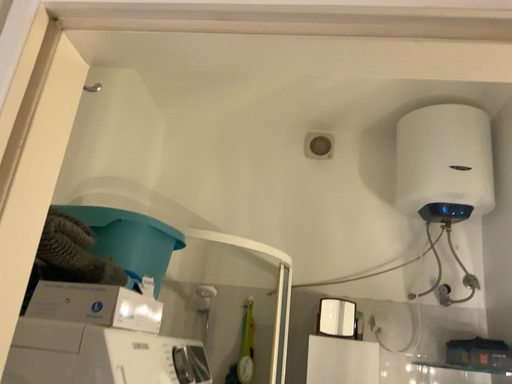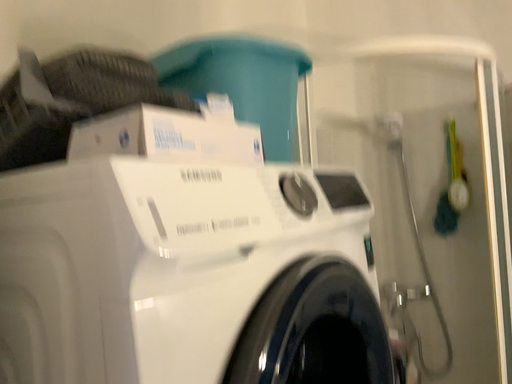
Question: How did the camera likely rotate when shooting the video?

Choices:
 (A) rotated downward
 (B) rotated upward

Answer: (A)